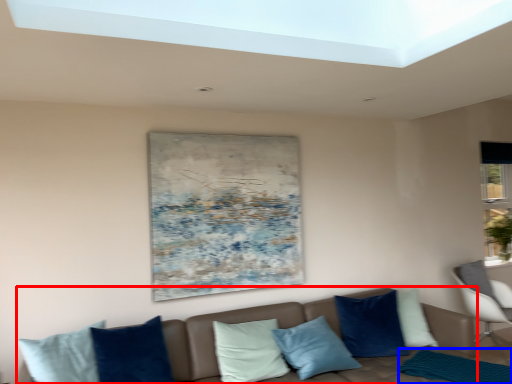
Question: Which object is further to the camera taking this photo, studio couch (highlighted by a red box) or mat (highlighted by a blue box)?

Choices:
 (A) studio couch
 (B) mat

Answer: (B)